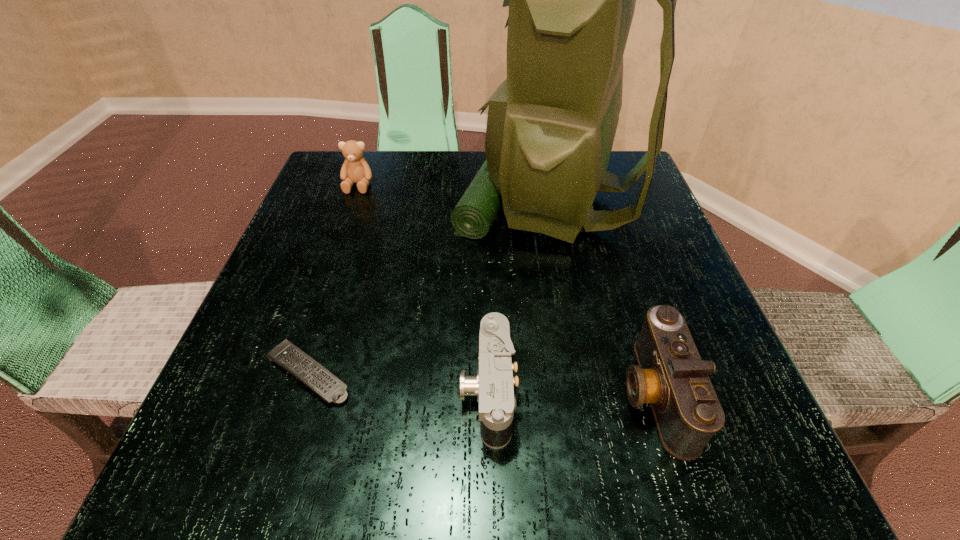
Locate an element on the screen. The width and height of the screenshot is (960, 540). remote control present at the left edge is located at coordinates (330, 388).

The image size is (960, 540). Identify the location of backpack positioned at the right edge. (551, 124).

This screenshot has height=540, width=960. In order to click on camera that is at the right edge in this screenshot , I will do `click(670, 375)`.

Where is `object that is positioned at the far left corner`? This screenshot has height=540, width=960. object that is positioned at the far left corner is located at coordinates (355, 169).

What are the coordinates of `object that is at the far right corner` in the screenshot? It's located at (551, 124).

Find the location of `object located at the near right corner`. object located at the near right corner is located at coordinates (670, 375).

Find the location of `vacant space at the near edge of the desktop`. vacant space at the near edge of the desktop is located at coordinates (440, 431).

In the image, there is a desktop. Identify the location of vacant space at the left edge. (350, 239).

Locate an element on the screen. The height and width of the screenshot is (540, 960). vacant space at the right edge of the desktop is located at coordinates (715, 381).

This screenshot has width=960, height=540. In the image, there is a desktop. Find the location of `free region at the far left corner`. free region at the far left corner is located at coordinates (332, 191).